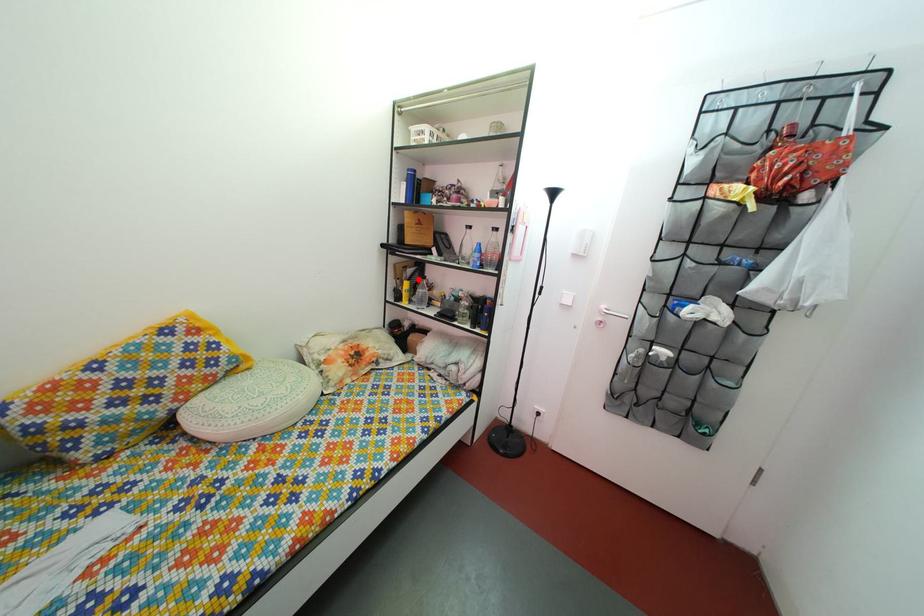
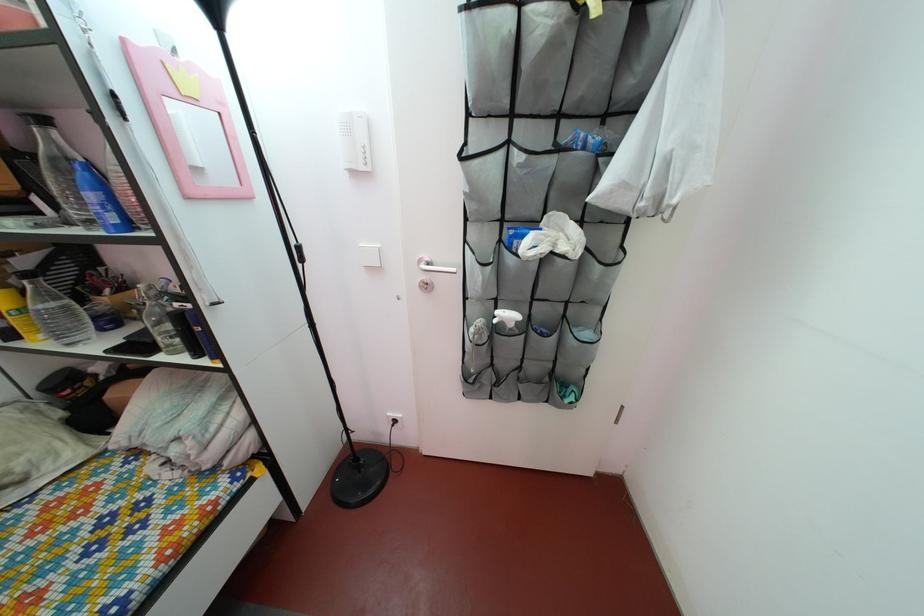
The point at the highlighted location is marked in the first image. Where is the corresponding point in the second image?

(32, 270)